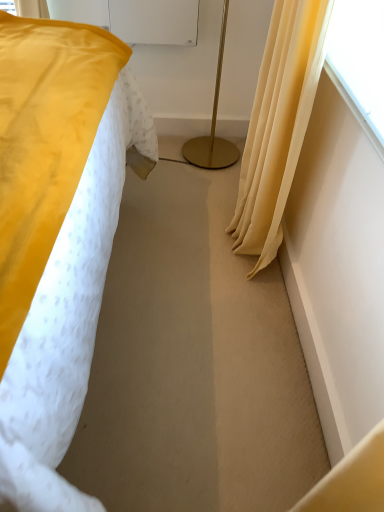
Where is `vacant space underneath gold metallic floor lamp at center (from a real-world perspective)`? vacant space underneath gold metallic floor lamp at center (from a real-world perspective) is located at coordinates (210, 154).